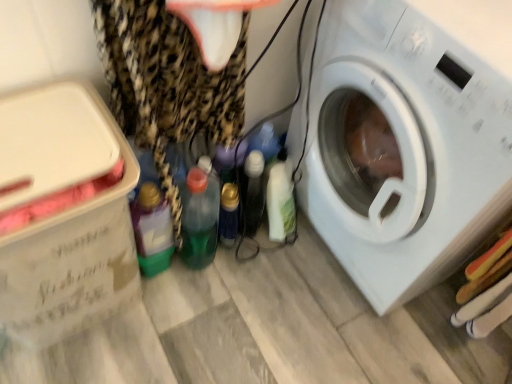
Question: Should I look upward or downward to see leopard print fabric at left?

Choices:
 (A) down
 (B) up

Answer: (B)

Question: Does translucent plastic bottle at center, marked as the second bottle in a right-to-left arrangement, have a greater height compared to green translucent bottle at center, which is the third bottle in right-to-left order?

Choices:
 (A) no
 (B) yes

Answer: (A)

Question: Is translucent plastic bottle at center, marked as the second bottle in a right-to-left arrangement, oriented away from green translucent bottle at center, the second bottle in the left-to-right sequence?

Choices:
 (A) yes
 (B) no

Answer: (A)

Question: Are translucent plastic bottle at center, which appears as the 3th bottle when viewed from the left, and green translucent bottle at center, the second bottle in the left-to-right sequence, located far from each other?

Choices:
 (A) yes
 (B) no

Answer: (B)

Question: From a real-world perspective, is translucent plastic bottle at center, marked as the second bottle in a right-to-left arrangement, physically below green translucent bottle at center, the second bottle in the left-to-right sequence?

Choices:
 (A) yes
 (B) no

Answer: (A)

Question: From the image's perspective, is translucent plastic bottle at center, marked as the second bottle in a right-to-left arrangement, below green translucent bottle at center, which is the third bottle in right-to-left order?

Choices:
 (A) no
 (B) yes

Answer: (A)

Question: Considering the relative sizes of translucent plastic bottle at center, which appears as the 3th bottle when viewed from the left, and green translucent bottle at center, which is the third bottle in right-to-left order, in the image provided, is translucent plastic bottle at center, which appears as the 3th bottle when viewed from the left, bigger than green translucent bottle at center, which is the third bottle in right-to-left order,?

Choices:
 (A) yes
 (B) no

Answer: (B)

Question: Could you tell me if white plastic washing machine at right is turned towards white glossy bottle at center, which ranks as the fourth bottle in left-to-right order?

Choices:
 (A) yes
 (B) no

Answer: (A)

Question: Does white plastic washing machine at right appear on the right side of white glossy bottle at center, marked as the first bottle in a right-to-left arrangement?

Choices:
 (A) no
 (B) yes

Answer: (B)

Question: Would you say white plastic washing machine at right contains white glossy bottle at center, which ranks as the fourth bottle in left-to-right order?

Choices:
 (A) yes
 (B) no

Answer: (B)

Question: Is the surface of white plastic washing machine at right in direct contact with white glossy bottle at center, which ranks as the fourth bottle in left-to-right order?

Choices:
 (A) no
 (B) yes

Answer: (A)

Question: Can you confirm if white plastic washing machine at right is bigger than white glossy bottle at center, marked as the first bottle in a right-to-left arrangement?

Choices:
 (A) yes
 (B) no

Answer: (A)

Question: Are white plastic washing machine at right and white glossy bottle at center, which ranks as the fourth bottle in left-to-right order, located far from each other?

Choices:
 (A) no
 (B) yes

Answer: (A)

Question: From a real-world perspective, is translucent plastic bottle at center, which appears as the 3th bottle when viewed from the left, physically above white plastic washing machine at right?

Choices:
 (A) yes
 (B) no

Answer: (B)